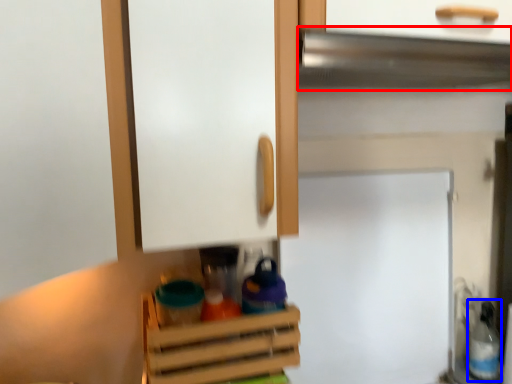
Question: Which of the following is the closest to the observer, exhaust hood (highlighted by a red box) or bottle (highlighted by a blue box)?

Choices:
 (A) exhaust hood
 (B) bottle

Answer: (A)